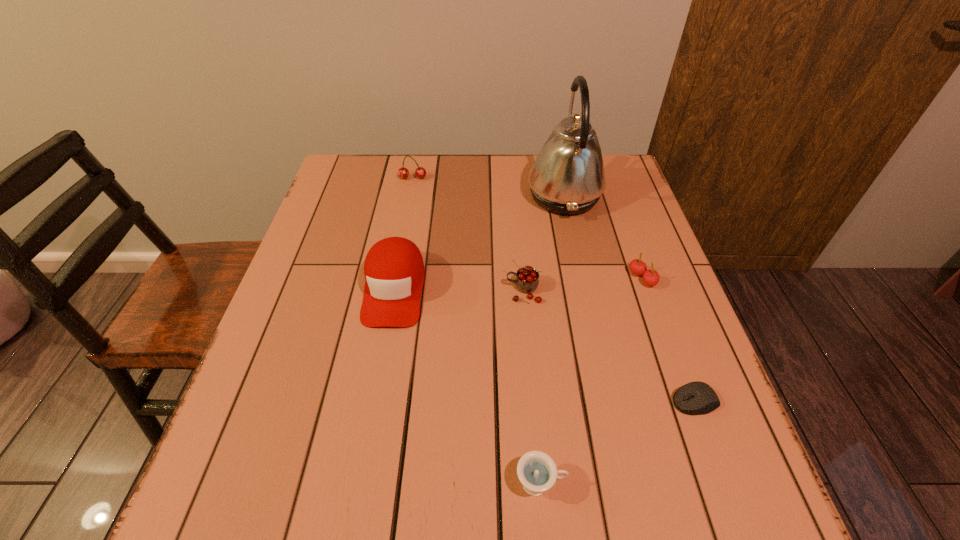
Where is `kettle`? kettle is located at coordinates (567, 177).

The image size is (960, 540). Find the location of `baseball cap`. baseball cap is located at coordinates (394, 272).

You are a GUI agent. You are given a task and a screenshot of the screen. Output one action in this format:
    pyautogui.click(x=<x>, y=<y>)
    Task: Click on the farthest cherry
    This screenshot has width=960, height=540.
    Given the screenshot: What is the action you would take?
    [420, 172]

Where is `the second cherry from left to right`? the second cherry from left to right is located at coordinates (527, 280).

Locate an element on the screen. the rightmost cherry is located at coordinates (651, 277).

Image resolution: width=960 pixels, height=540 pixels. I want to click on teacup, so click(537, 471).

Find the location of a particular element. The image size is (960, 540). computer equipment is located at coordinates (695, 398).

At what (x,y) coordinates should I click in order to perform the action: click on the shortest object. Please return your answer as a coordinate pair (x, y). The image size is (960, 540). Looking at the image, I should click on (695, 398).

This screenshot has height=540, width=960. What are the coordinates of `free space located from the spout of the kettle` in the screenshot? It's located at (475, 196).

Locate an element on the screen. vacant area located from the spout of the kettle is located at coordinates (492, 196).